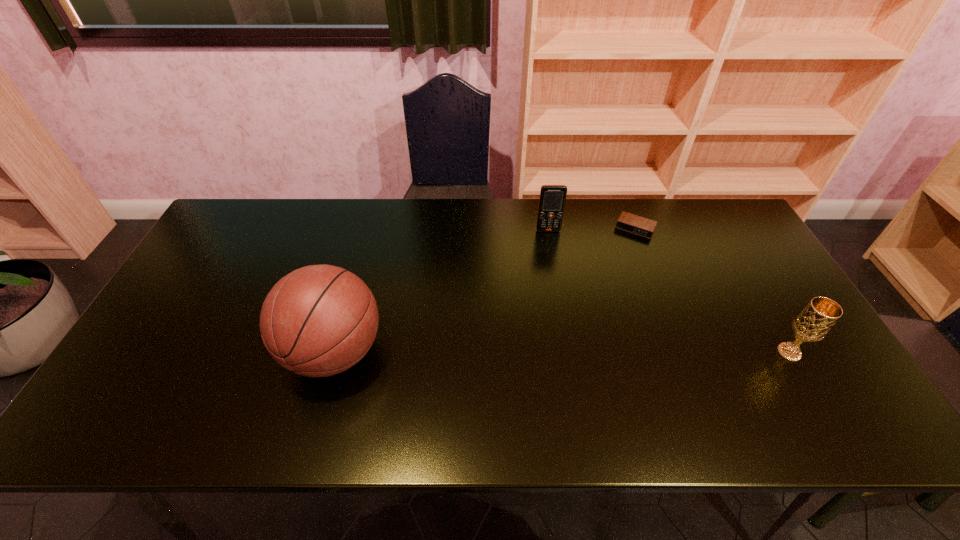
You are a GUI agent. You are given a task and a screenshot of the screen. Output one action in this format:
    pyautogui.click(x=<x>, y=<y>)
    Task: Click on the free space between the alarm clock and the chalice
    This screenshot has width=960, height=540.
    Given the screenshot: What is the action you would take?
    pyautogui.click(x=712, y=290)

Where is `free space between the shortest object and the rightmost object`? free space between the shortest object and the rightmost object is located at coordinates (712, 290).

You are a GUI agent. You are given a task and a screenshot of the screen. Output one action in this format:
    pyautogui.click(x=<x>, y=<y>)
    Task: Click on the unoccupied position between the chalice and the cellular telephone
    The width and height of the screenshot is (960, 540).
    Given the screenshot: What is the action you would take?
    pyautogui.click(x=668, y=292)

Find the location of `vacant point located between the cellular telephone and the basketball`. vacant point located between the cellular telephone and the basketball is located at coordinates (442, 292).

This screenshot has width=960, height=540. I want to click on free spot between the rightmost object and the leftmost object, so click(562, 352).

Locate an element on the screen. The width and height of the screenshot is (960, 540). object that stands as the third closest to the chalice is located at coordinates (319, 320).

Locate which object ranks second in proximity to the rightmost object. Please provide its 2D coordinates. Your answer should be formatted as a tuple, i.e. [(x, y)], where the tuple contains the x and y coordinates of a point satisfying the conditions above.

[(552, 200)]

Where is `vacant point that satisfies the following two spatial constraints: 1. on the front side of the alarm clock; 2. on the right side of the rightmost object`? The image size is (960, 540). vacant point that satisfies the following two spatial constraints: 1. on the front side of the alarm clock; 2. on the right side of the rightmost object is located at coordinates (683, 352).